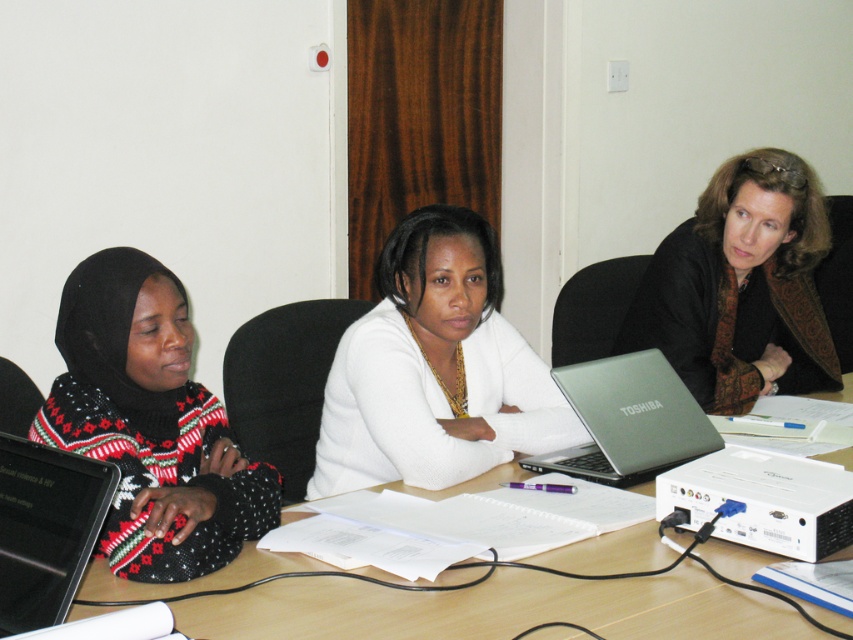
Looking at this image, you are a participant in the meeting and need to pass a document from the black glossy laptop at left to the silver metallic laptop at center. Can you directly hand it over without moving from your seat?

The black glossy laptop at left is closer to the viewer than the silver metallic laptop at center, so you can directly hand over the document from the black glossy laptop at left to the silver metallic laptop at center without moving from your seat.

What is the exact coordinate of the black glossy laptop at left?

The black glossy laptop at left is located at point (45, 529).

Based on the photo, you are organizing a group activity and need to place a 1.5 meter long whiteboard between the black glossy laptop at left and the wooden table at center. Is there enough space between them to fit the whiteboard?

The black glossy laptop at left is positioned on the left side of wooden table at center, but the distance between them isn not specified in the objects description. Therefore, it is impossible to determine if the whiteboard will fit.